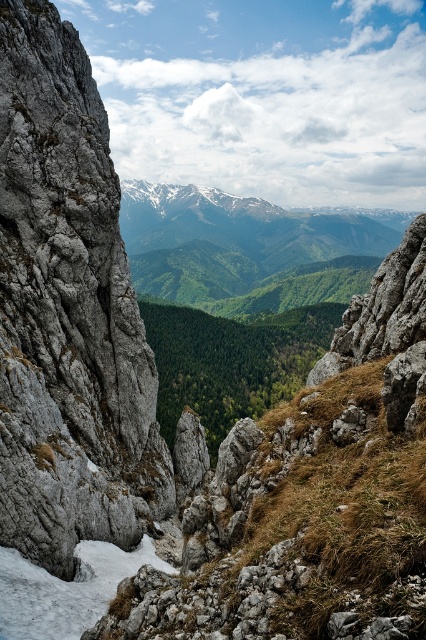
You are a hiker planning to cross the rocky terrain in the image. You see the gray rough rock at left and the white frosty snow at lower left. Which of these two features is closer to your current position?

The gray rough rock at left is closer to you because it is positioned further to the viewer than the white frosty snow at lower left, meaning it lies in front of the snow in the landscape.

You are a geologist examining the mountain landscape. You need to locate the gray rough rock at left. What are its coordinates?

The gray rough rock at left is located at point (68, 312).